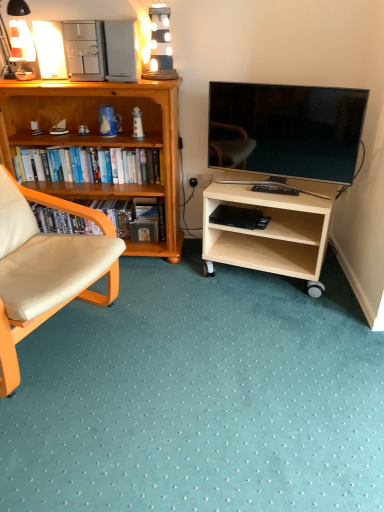
Find the location of a particular element. The height and width of the screenshot is (512, 384). free space in front of wooden bookshelf at left, positioned as the 2th desk in right-to-left order is located at coordinates (159, 303).